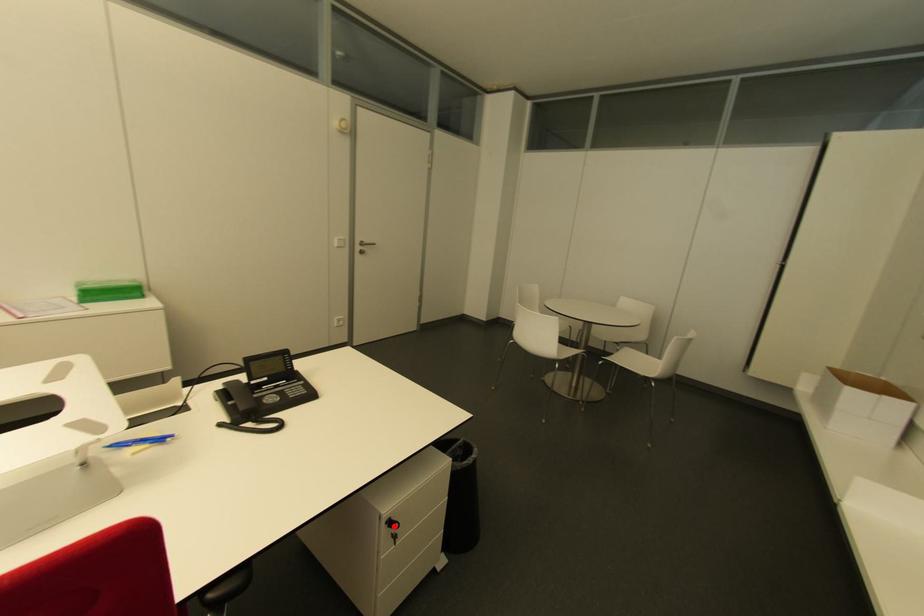
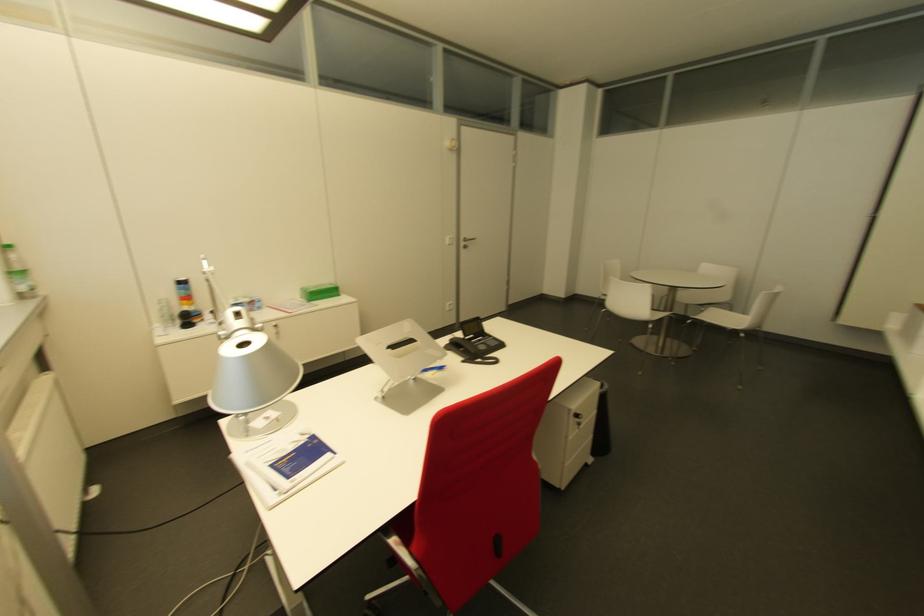
Where in the second image is the point corresponding to the highlighted location from the first image?

(579, 418)